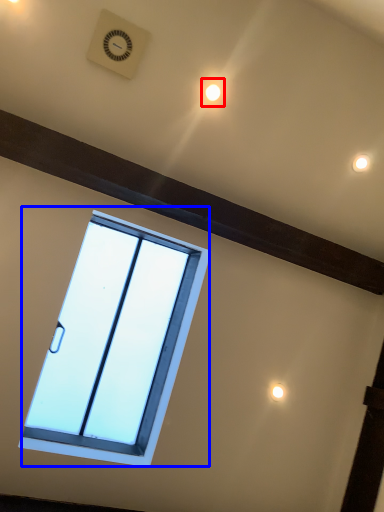
Question: Which point is closer to the camera, light (highlighted by a red box) or window (highlighted by a blue box)?

Choices:
 (A) light
 (B) window

Answer: (B)